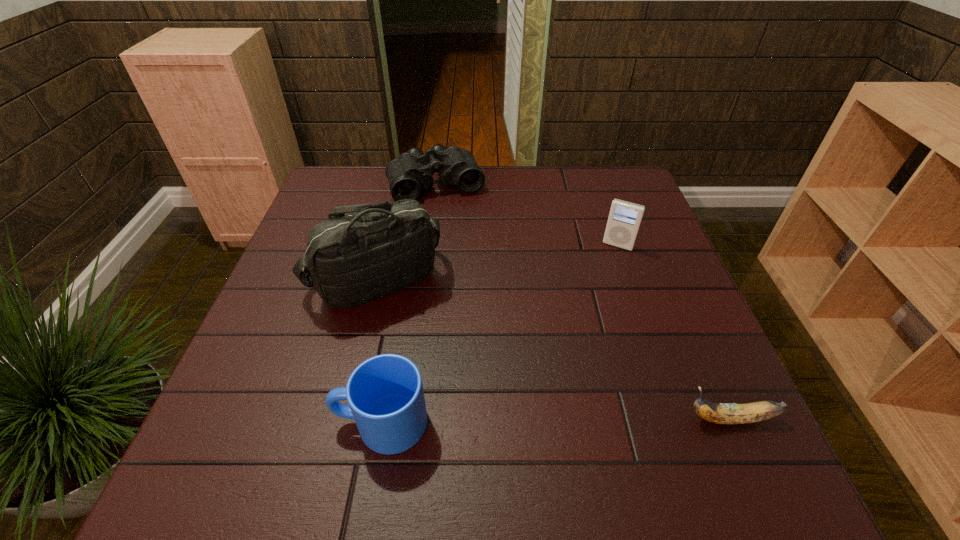
At what (x,y) coordinates should I click in order to perform the action: click on vacant space at the right edge. Please return your answer as a coordinate pair (x, y). This screenshot has height=540, width=960. Looking at the image, I should click on (665, 343).

In order to click on vacant area at the near left corner in this screenshot , I will do `click(305, 402)`.

Image resolution: width=960 pixels, height=540 pixels. What are the coordinates of `free point at the far right corner` in the screenshot? It's located at (617, 173).

You are a GUI agent. You are given a task and a screenshot of the screen. Output one action in this format:
    pyautogui.click(x=<x>, y=<y>)
    Task: Click on the vacant point located between the banana and the mug
    Image resolution: width=960 pixels, height=540 pixels.
    Given the screenshot: What is the action you would take?
    pyautogui.click(x=556, y=421)

The height and width of the screenshot is (540, 960). What are the coordinates of `unoccupied area between the banana and the shoulder bag` in the screenshot? It's located at (553, 349).

Find the location of `free area in between the mug and the shoulder bag`. free area in between the mug and the shoulder bag is located at coordinates (378, 351).

The height and width of the screenshot is (540, 960). In order to click on free space between the shoulder bag and the iPod in this screenshot , I will do `click(496, 262)`.

Identify the location of vacant space that's between the iPod and the shortest object. (674, 332).

Locate an element on the screen. The image size is (960, 540). empty space that is in between the mug and the banana is located at coordinates (556, 421).

The image size is (960, 540). In order to click on free space between the tallest object and the iPod in this screenshot , I will do tap(496, 262).